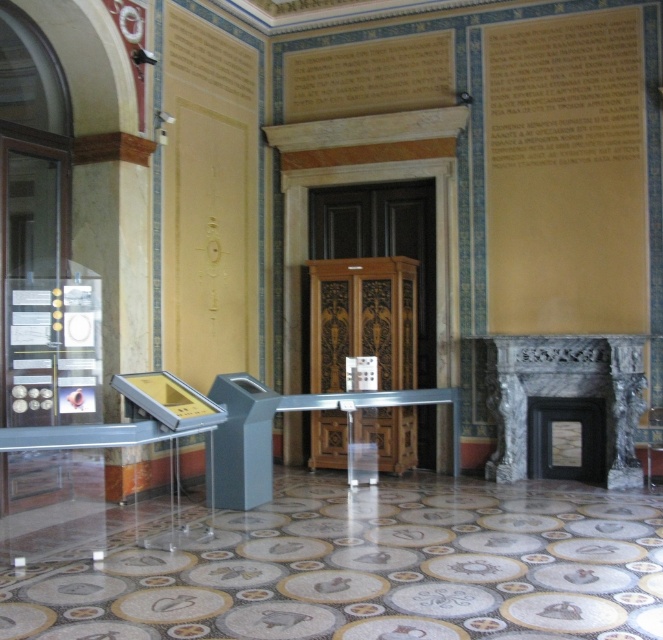
Question: Is wooden carved elevator at center in front of marble fireplace at right?

Choices:
 (A) no
 (B) yes

Answer: (A)

Question: Considering the relative positions of wooden carved elevator at center and marble fireplace at right in the image provided, where is wooden carved elevator at center located with respect to marble fireplace at right?

Choices:
 (A) left
 (B) right

Answer: (A)

Question: Is wooden carved elevator at center positioned before marble fireplace at right?

Choices:
 (A) no
 (B) yes

Answer: (A)

Question: Which point is farther from the camera taking this photo?

Choices:
 (A) (373, 337)
 (B) (554, 365)

Answer: (A)

Question: Among these points, which one is farthest from the camera?

Choices:
 (A) (518, 477)
 (B) (371, 348)

Answer: (B)